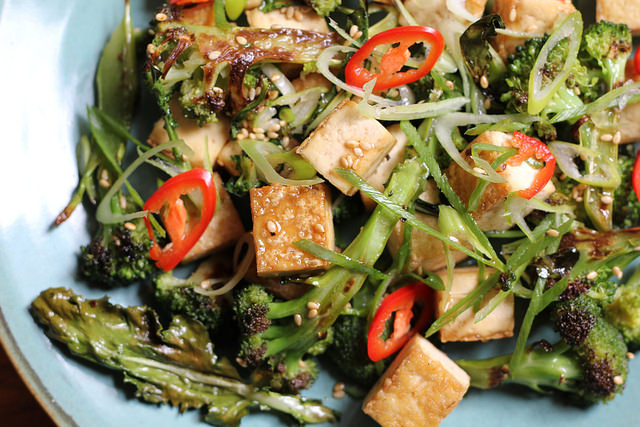
The height and width of the screenshot is (427, 640). Identify the location of reflection of light on plate. (34, 125).